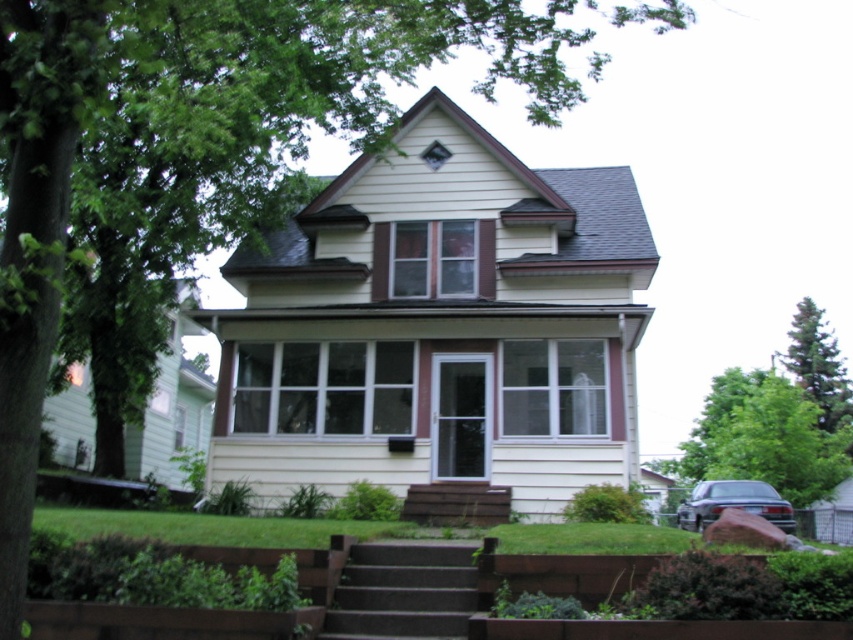
Is brown stone stairs at lower center smaller than brown wooden stairs at center?

Yes, brown stone stairs at lower center is smaller than brown wooden stairs at center.

This screenshot has width=853, height=640. I want to click on brown stone stairs at lower center, so click(x=403, y=593).

Image resolution: width=853 pixels, height=640 pixels. Find the location of `brown stone stairs at lower center`. brown stone stairs at lower center is located at coordinates (403, 593).

Is brown stone stairs at lower center further to camera compared to green textured pine tree at upper right?

That is False.

How much distance is there between brown stone stairs at lower center and green textured pine tree at upper right?

They are 153.45 feet apart.

Between point (399, 573) and point (834, 385), which one is positioned behind?

Positioned behind is point (834, 385).

Identify the location of brown stone stairs at lower center. The width and height of the screenshot is (853, 640). (403, 593).

Which is in front, point (706, 465) or point (387, 589)?

Point (387, 589) is more forward.

Who is positioned more to the left, green leafy tree at right or brown stone stairs at lower center?

brown stone stairs at lower center is more to the left.

Locate an element on the screen. green leafy tree at right is located at coordinates (764, 436).

What are the coordinates of `green leafy tree at right` in the screenshot? It's located at (764, 436).